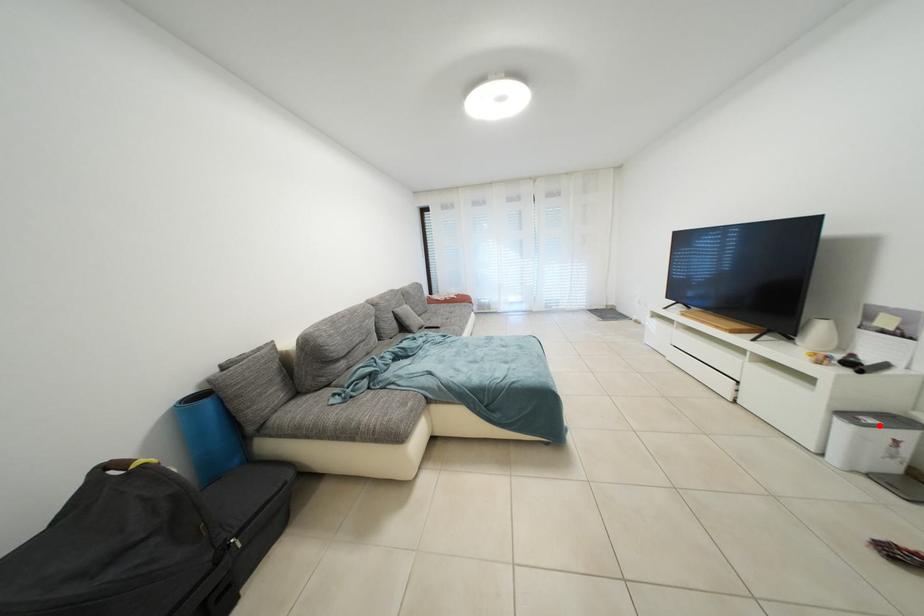
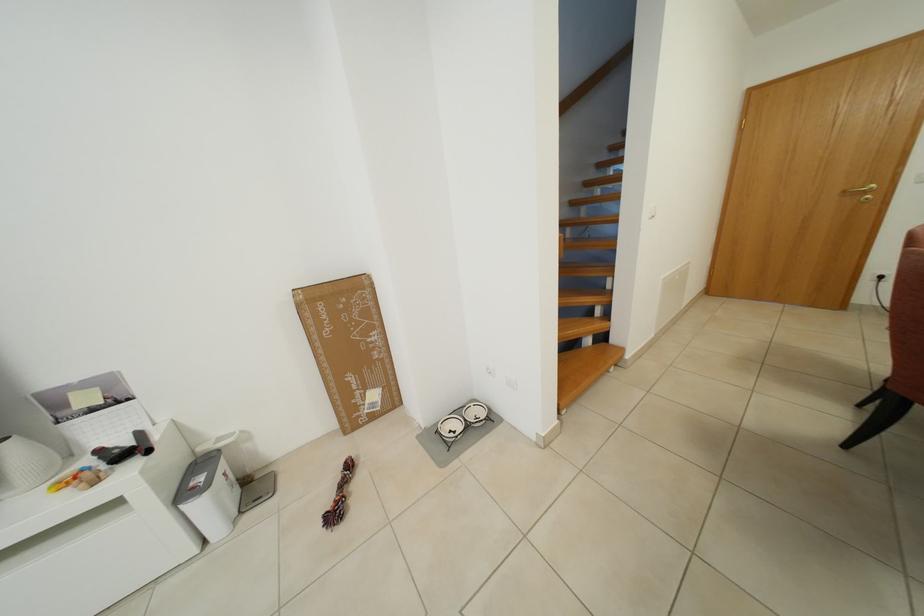
Question: I am providing you with two images of the same scene from different viewpoints. A red point is shown in image1. For the corresponding object point in image2, is it positioned nearer or farther from the camera?

Choices:
 (A) Nearer
 (B) Farther

Answer: (A)